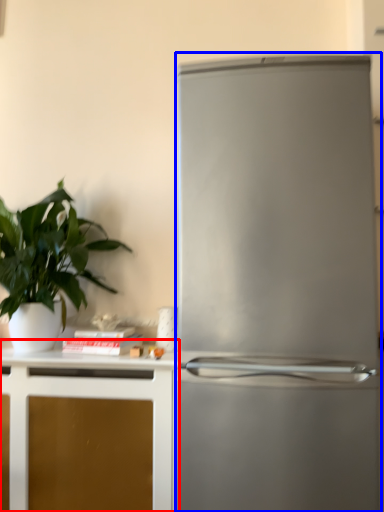
Question: Which object appears farthest to the camera in this image, cabinetry (highlighted by a red box) or refrigerator (highlighted by a blue box)?

Choices:
 (A) cabinetry
 (B) refrigerator

Answer: (A)